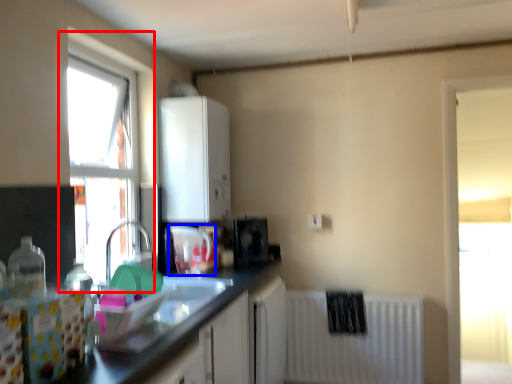
Question: Which object is closer to the camera taking this photo, window (highlighted by a red box) or appliance (highlighted by a blue box)?

Choices:
 (A) window
 (B) appliance

Answer: (A)